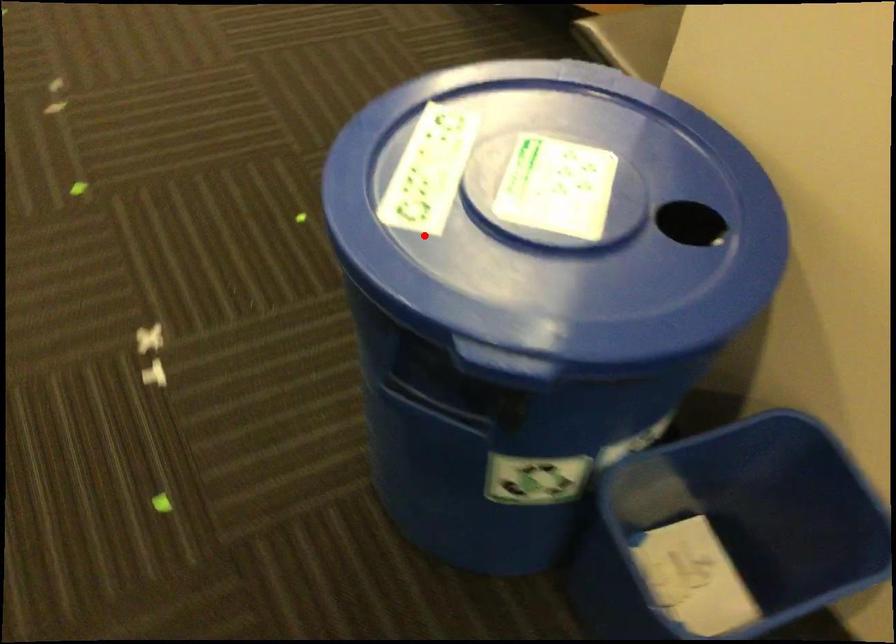
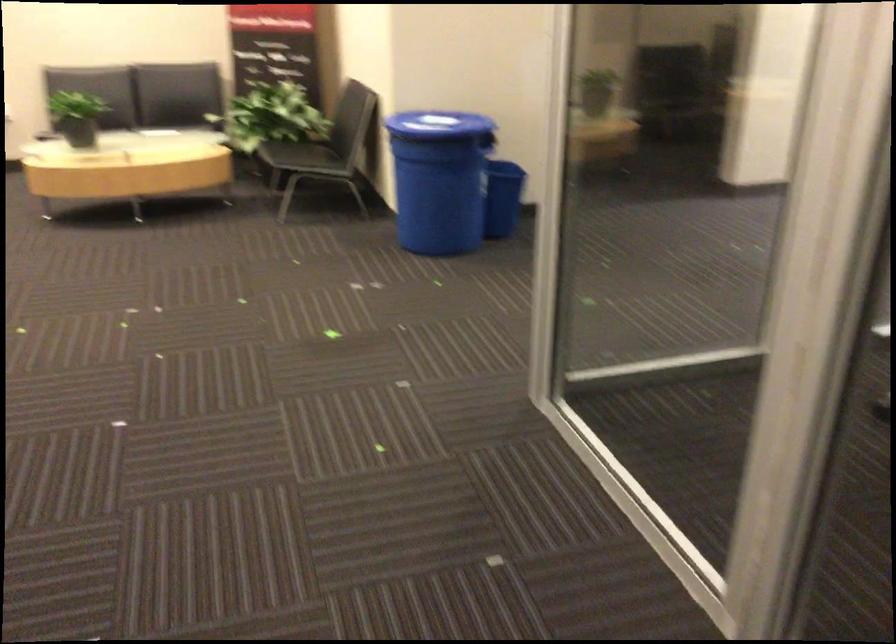
Question: I am providing you with two images of the same scene from different viewpoints. Image1 has a red point marked. In image2, the corresponding 3D location appears at what relative position? Reply with the corresponding letter.

Choices:
 (A) Closer
 (B) Farther

Answer: (B)